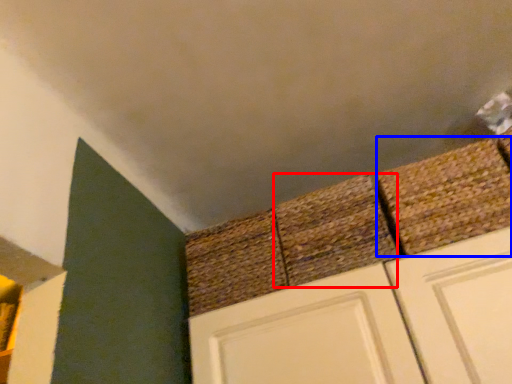
Question: Which point is further to the camera, brick (highlighted by a red box) or brick (highlighted by a blue box)?

Choices:
 (A) brick
 (B) brick

Answer: (A)